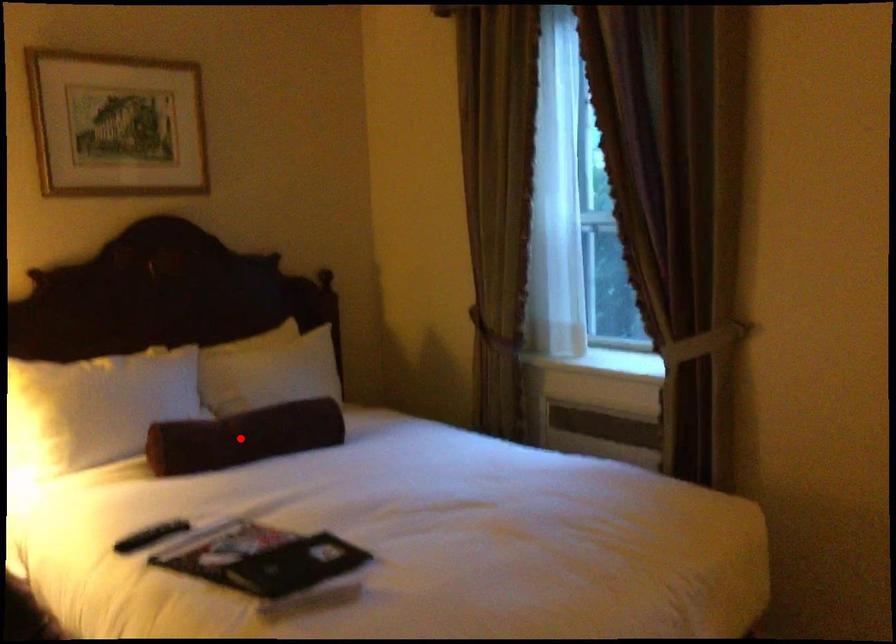
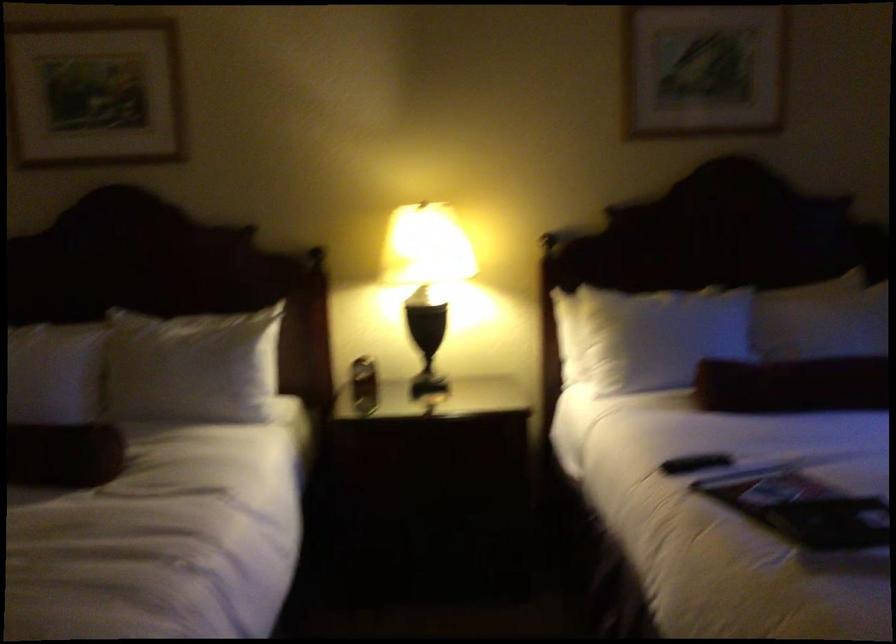
Where in the second image is the point corresponding to the highlighted location from the first image?

(793, 384)